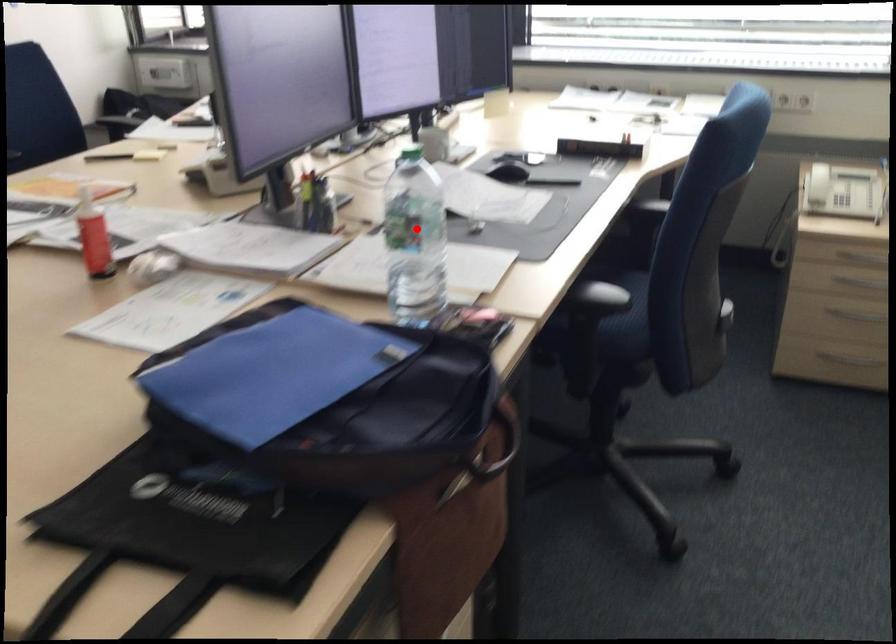
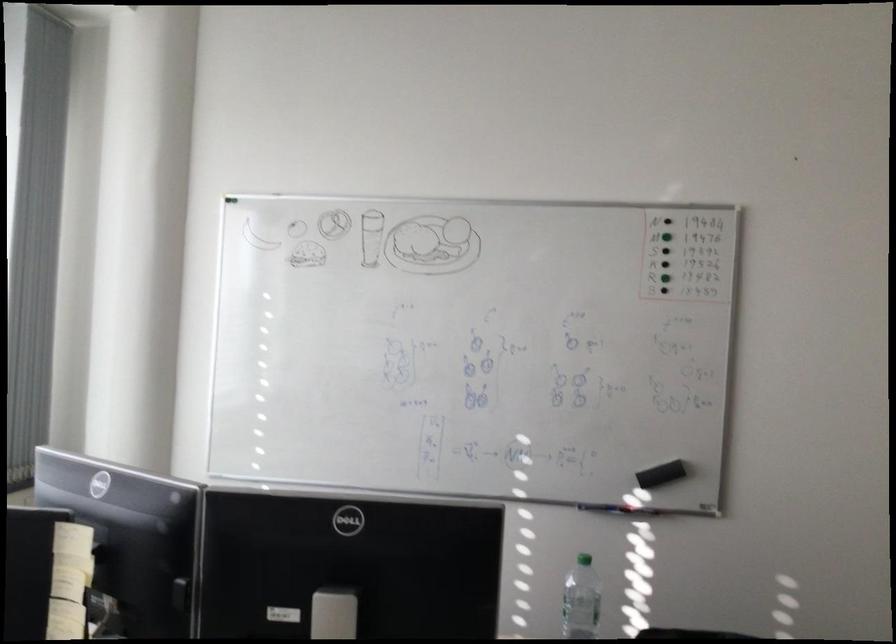
Locate, in the second image, the point that corresponds to the highlighted location in the first image.

(581, 600)